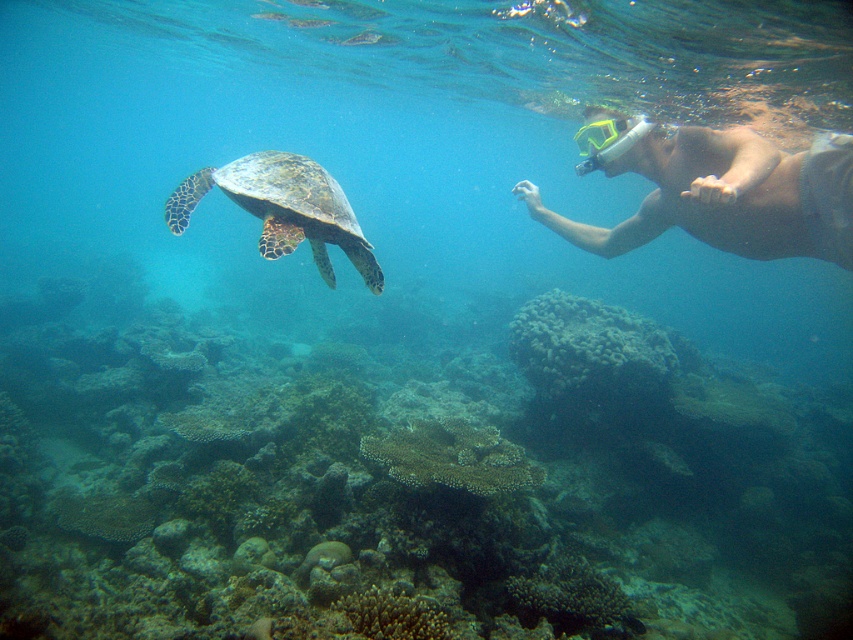
Does leathery greenish-brown turtle at left have a larger size compared to yellow-green plastic snorkel mask at upper right?

Yes.

Is leathery greenish-brown turtle at left smaller than yellow-green plastic snorkel mask at upper right?

Actually, leathery greenish-brown turtle at left might be larger than yellow-green plastic snorkel mask at upper right.

Does point (283, 188) come in front of point (640, 129)?

Yes.

Locate an element on the screen. This screenshot has width=853, height=640. leathery greenish-brown turtle at left is located at coordinates (283, 209).

Who is shorter, smooth skin diver at right or yellow-green plastic snorkel mask at upper right?

With less height is yellow-green plastic snorkel mask at upper right.

Which is more to the right, smooth skin diver at right or yellow-green plastic snorkel mask at upper right?

From the viewer's perspective, yellow-green plastic snorkel mask at upper right appears more on the right side.

Identify the location of smooth skin diver at right. (726, 195).

This screenshot has height=640, width=853. I want to click on smooth skin diver at right, so click(x=726, y=195).

Is brown coral reef at center above yellow-green plastic snorkel mask at upper right?

No.

Which is behind, point (328, 540) or point (639, 124)?

The point (639, 124) is behind.

Where is `brown coral reef at center`? Image resolution: width=853 pixels, height=640 pixels. brown coral reef at center is located at coordinates (408, 483).